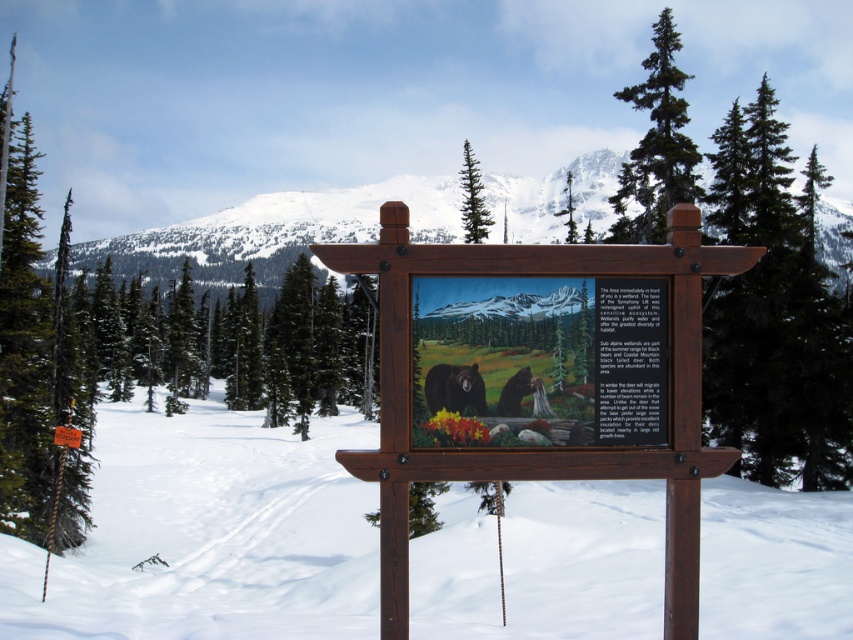
Question: Does green evergreen tree at right come in front of green coniferous tree at upper right?

Choices:
 (A) yes
 (B) no

Answer: (A)

Question: Which is nearer to the wooden signboard at center?

Choices:
 (A) dead wood at left
 (B) wooden signpost at center

Answer: (B)

Question: Which of these objects is positioned closest to the green evergreen tree at right?

Choices:
 (A) wooden signpost at center
 (B) wooden sign at center

Answer: (B)

Question: Can you confirm if wooden sign at center is positioned above green coniferous tree at upper center?

Choices:
 (A) yes
 (B) no

Answer: (B)

Question: Considering the real-world distances, which object is closest to the green evergreen tree at right?

Choices:
 (A) snowy white mountain at upper center
 (B) wooden sign at center
 (C) wooden signpost at center
 (D) green coniferous tree at upper center

Answer: (B)

Question: Can you confirm if wooden signpost at center is bigger than green evergreen tree at right?

Choices:
 (A) yes
 (B) no

Answer: (B)